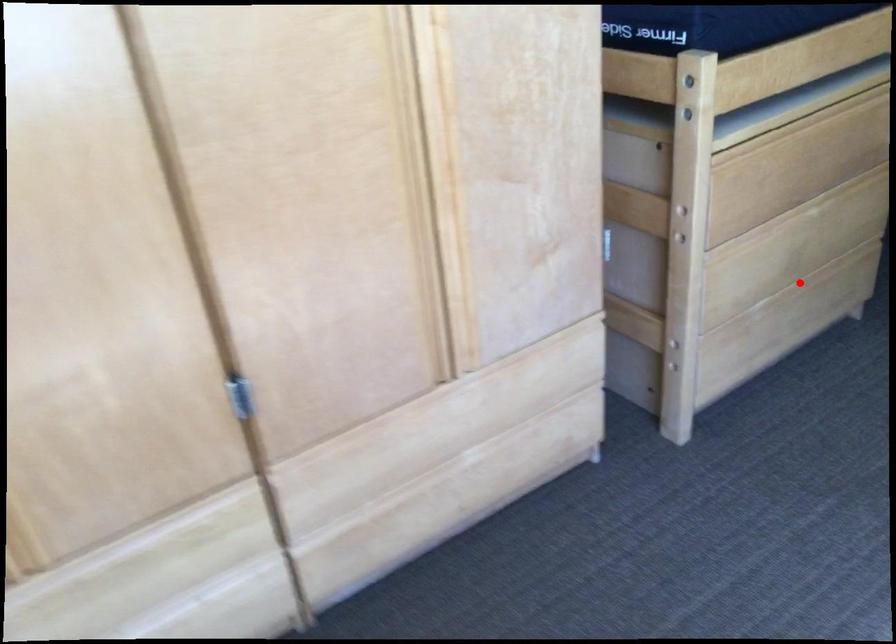
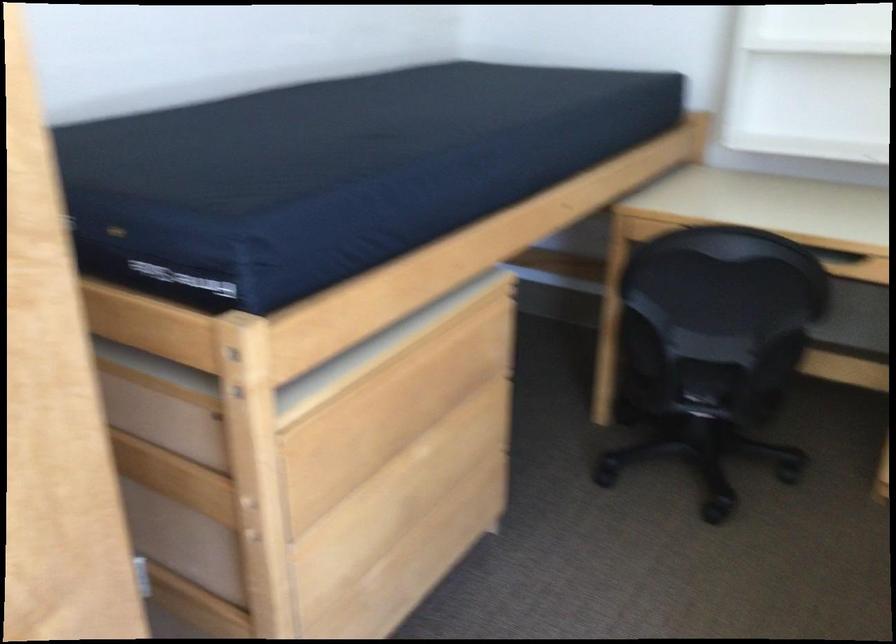
Find the pixel in the second image that matches the highlighted location in the first image.

(427, 532)